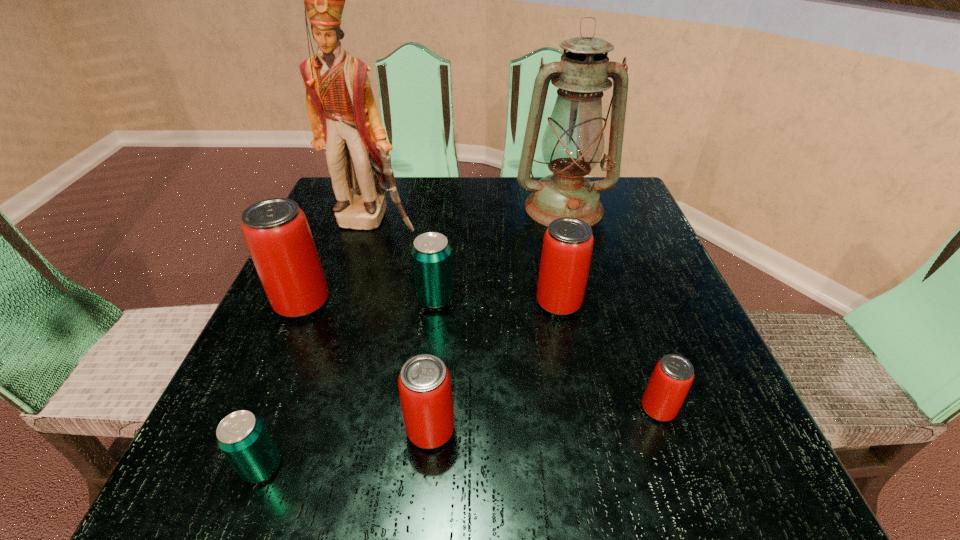
Find the location of a particular element. This screenshot has width=960, height=540. free space located 0.170m on the back of the left teal beer can is located at coordinates (306, 351).

At what (x,y) coordinates should I click in order to perform the action: click on nutcracker located in the far edge section of the desktop. Please return your answer as a coordinate pair (x, y). The image size is (960, 540). Looking at the image, I should click on (342, 110).

The height and width of the screenshot is (540, 960). I want to click on oil lamp at the far edge, so click(573, 143).

At what (x,y) coordinates should I click in order to perform the action: click on nutcracker located in the left edge section of the desktop. Please return your answer as a coordinate pair (x, y). This screenshot has width=960, height=540. Looking at the image, I should click on (342, 110).

Locate an element on the screen. Image resolution: width=960 pixels, height=540 pixels. oil lamp at the right edge is located at coordinates (573, 143).

Where is `beer can located at the right edge`? The image size is (960, 540). beer can located at the right edge is located at coordinates (673, 375).

I want to click on object present at the far left corner, so click(x=342, y=110).

The width and height of the screenshot is (960, 540). I want to click on object that is at the near left corner, so click(242, 437).

The width and height of the screenshot is (960, 540). I want to click on object positioned at the far right corner, so click(573, 143).

At what (x,y) coordinates should I click in order to perform the action: click on vacant region at the far edge of the desktop. Please return your answer as a coordinate pair (x, y). Image resolution: width=960 pixels, height=540 pixels. Looking at the image, I should click on (440, 192).